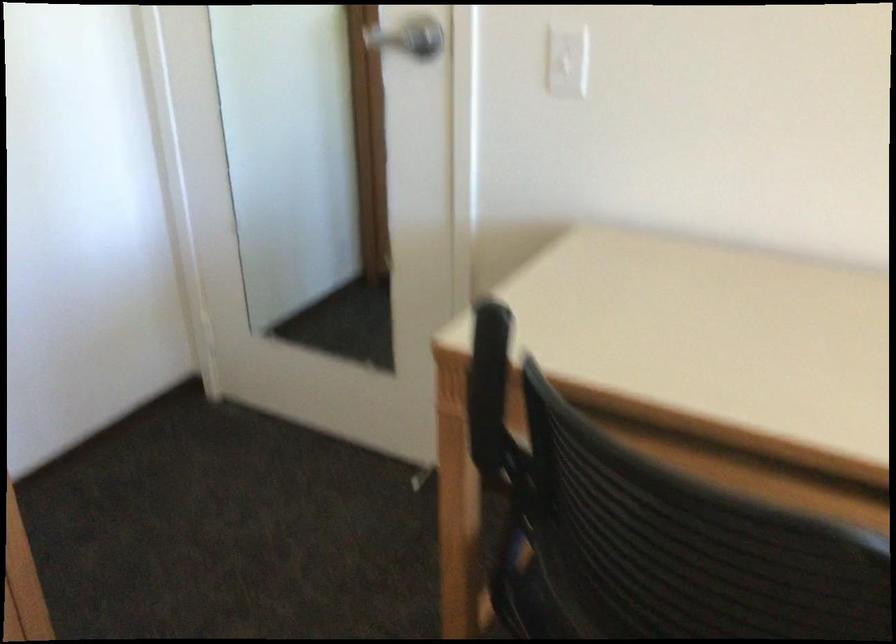
Image resolution: width=896 pixels, height=644 pixels. In order to click on silver door handle in this screenshot , I will do `click(390, 41)`.